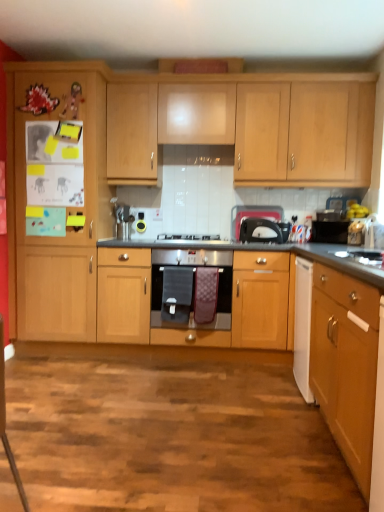
Question: Are wooden cabinet at left, the 2th cabinetry in the back-to-front sequence, and wooden cabinet at center, which is the 2th cabinetry in front-to-back order, far apart?

Choices:
 (A) no
 (B) yes

Answer: (A)

Question: Is wooden cabinet at left, the 2th cabinetry in the back-to-front sequence, next to wooden cabinet at center, acting as the 3th cabinetry starting from the back?

Choices:
 (A) yes
 (B) no

Answer: (B)

Question: Does wooden cabinet at left, the 2th cabinetry in the back-to-front sequence, have a lesser width compared to wooden cabinet at center, which is the 2th cabinetry in front-to-back order?

Choices:
 (A) no
 (B) yes

Answer: (B)

Question: Is wooden cabinet at left, the 2th cabinetry in the back-to-front sequence, taller than wooden cabinet at center, which is the 2th cabinetry in front-to-back order?

Choices:
 (A) no
 (B) yes

Answer: (B)

Question: Could you tell me if wooden cabinet at left, the 2th cabinetry in the back-to-front sequence, is turned towards wooden cabinet at center, acting as the 3th cabinetry starting from the back?

Choices:
 (A) no
 (B) yes

Answer: (A)

Question: Based on their sizes in the image, would you say matte black toaster at center is bigger or smaller than white glossy sink at right?

Choices:
 (A) big
 (B) small

Answer: (B)

Question: From a real-world perspective, relative to white glossy sink at right, is matte black toaster at center vertically above or below?

Choices:
 (A) below
 (B) above

Answer: (B)

Question: Is point (266, 208) positioned closer to the camera than point (375, 254)?

Choices:
 (A) closer
 (B) farther

Answer: (B)

Question: Is matte black toaster at center inside the boundaries of white glossy sink at right, or outside?

Choices:
 (A) outside
 (B) inside

Answer: (A)

Question: Based on their positions, is wooden cabinet at left, which is counted as the third cabinetry, starting from the front, located to the left or right of satin silver gas stove at center?

Choices:
 (A) right
 (B) left

Answer: (B)

Question: From their relative heights in the image, would you say wooden cabinet at left, the 2th cabinetry in the back-to-front sequence, is taller or shorter than satin silver gas stove at center?

Choices:
 (A) tall
 (B) short

Answer: (A)

Question: Is point pyautogui.click(x=91, y=99) positioned closer to the camera than point pyautogui.click(x=185, y=238)?

Choices:
 (A) closer
 (B) farther

Answer: (A)

Question: From a real-world perspective, is wooden cabinet at left, which is counted as the third cabinetry, starting from the front, physically located above or below satin silver gas stove at center?

Choices:
 (A) above
 (B) below

Answer: (A)

Question: Is satin silver gas stove at center in front of or behind light wood cabinet at upper center, which appears as the 1th cabinetry when viewed from the back, in the image?

Choices:
 (A) front
 (B) behind

Answer: (A)

Question: Is satin silver gas stove at center taller or shorter than light wood cabinet at upper center, which appears as the 1th cabinetry when viewed from the back?

Choices:
 (A) short
 (B) tall

Answer: (A)